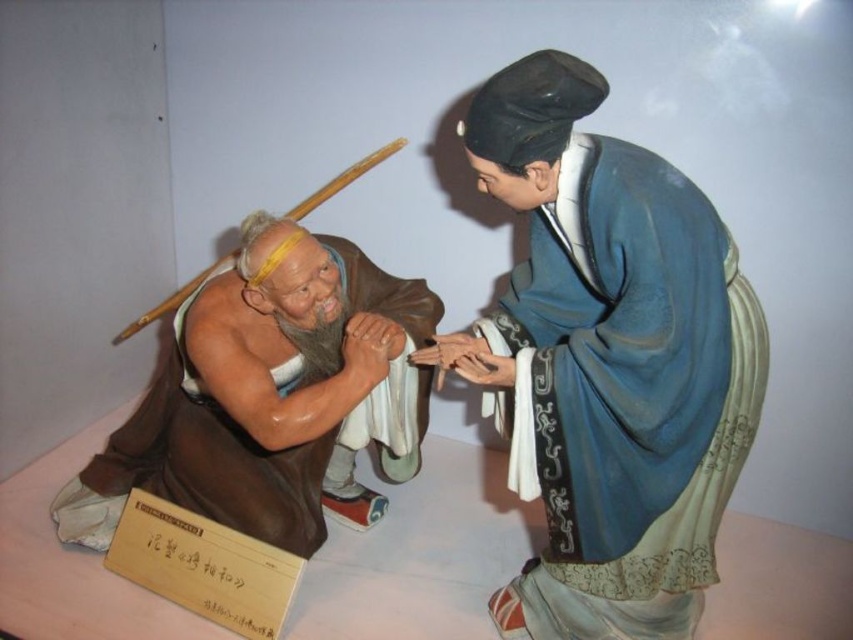
Can you confirm if blue silk robe at upper right is thinner than brown matte statue at left?

Yes.

Is blue silk robe at upper right smaller than brown matte statue at left?

Yes.

Is point (711, 378) in front of point (193, 422)?

Yes, point (711, 378) is closer to viewer.

At what (x,y) coordinates should I click in order to perform the action: click on blue silk robe at upper right. Please return your answer as a coordinate pair (x, y). Looking at the image, I should click on (622, 394).